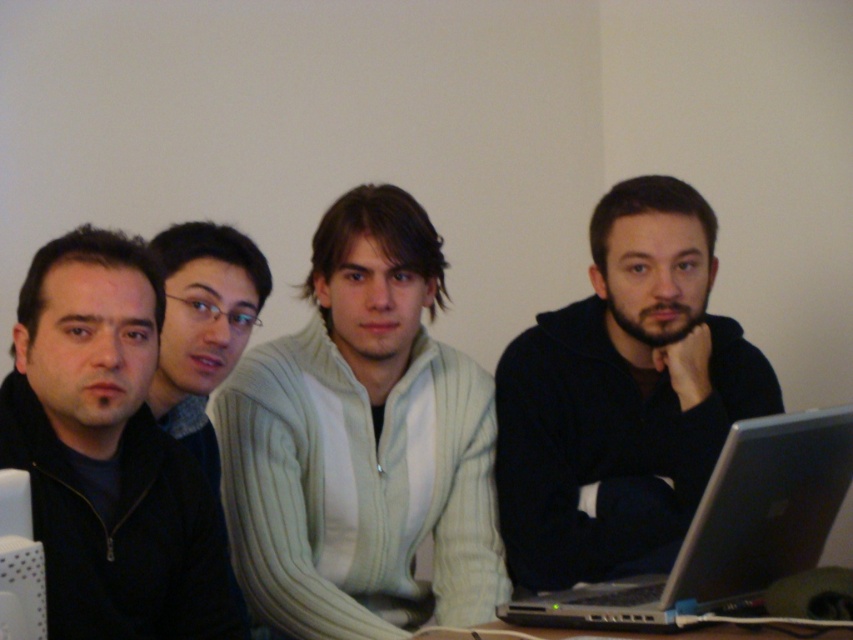
You are a fashion designer observing the image. You need to determine which garment is more suitable for a winter collection. Based on the size and material described, which item would you choose between the black matte jacket at center and the matte gray sweater at center?

The black matte jacket at center has a larger size compared to the matte gray sweater at center, making it more suitable for a winter collection as larger garments typically provide better insulation and coverage against cold weather.

Looking at this image, you are looking at the image of four people sitting together. Where is the black matte jacket at center located in terms of its 2D coordinates?

The black matte jacket at center is located at the 2D coordinates point (622,396).

You are standing at the point marked as point (602,205). You want to walk to the first individual. Are you close enough to shake hands with them?

The distance between you and the first individual is 1.73 meters, which is too far to shake hands comfortably. You need to move closer.